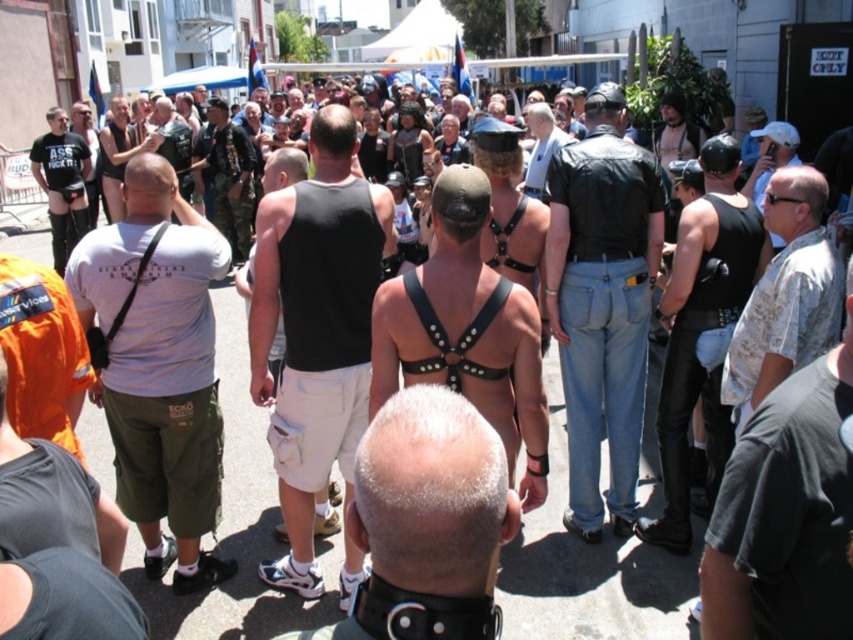
You are a photographer trying to capture the scene of the lively outdoor gathering. You want to focus on the white matte shorts at center. Where exactly should you aim your camera to capture this object?

The white matte shorts at center are located at point 0.775 on the x axis and 0.506 on the y axis, so you should aim your camera at those coordinates to capture the object.